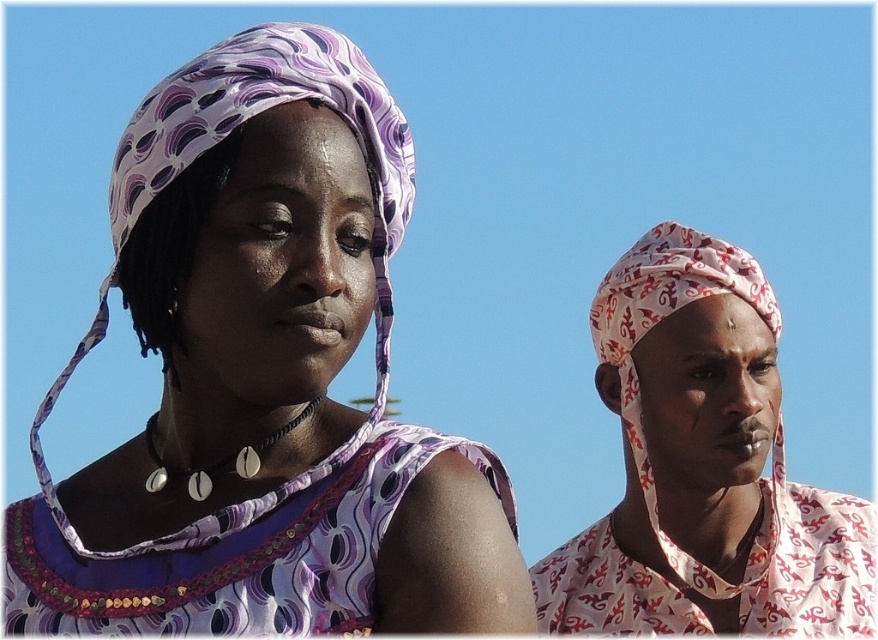
You are a photographer trying to capture a photo of both the purple printed headscarf at upper left and the printed fabric headscarf at right. Since you want both headscarves to be clearly visible in the frame, which direction should you move your camera to ensure both are in the shot?

The purple printed headscarf at upper left is to the left of the printed fabric headscarf at right, so moving the camera to the left would ensure both headscarves are visible in the frame.

You are standing at the origin point in the image and want to walk towards the two points labeled point (252, 60) and point (296, 554). Which point will you reach first?

Point (296, 554) will be reached first because it is closer to the origin point compared to point (252, 60), which is further away.